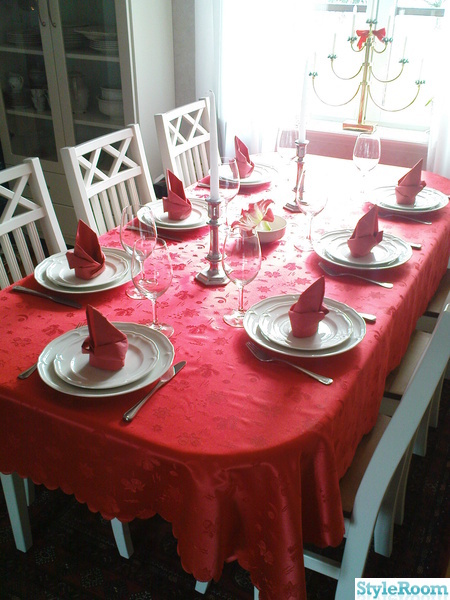
Identify the location of 7 napkins. (110, 338), (85, 249), (180, 203), (240, 158), (417, 183), (361, 228), (306, 299).